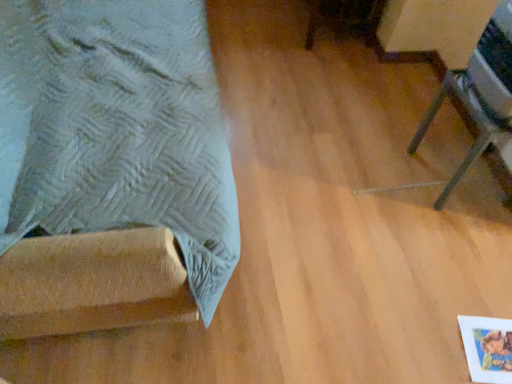
You are a GUI agent. You are given a task and a screenshot of the screen. Output one action in this format:
    pyautogui.click(x=<x>, y=<y>)
    Task: Click on the vacant space behind metallic silver tripod at right, the first furniture from the right
    The image size is (512, 384).
    Given the screenshot: What is the action you would take?
    pyautogui.click(x=420, y=123)